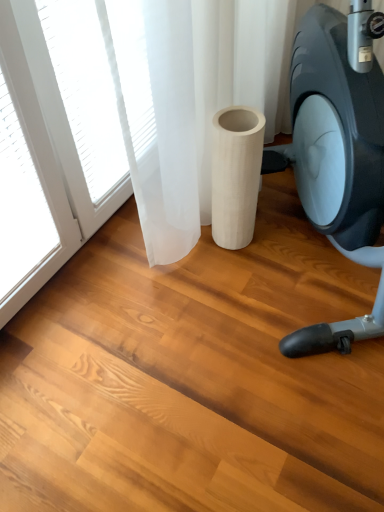
Identify the location of vacant space underneath matte black stationary bicycle at right (from a real-world perspective). (304, 262).